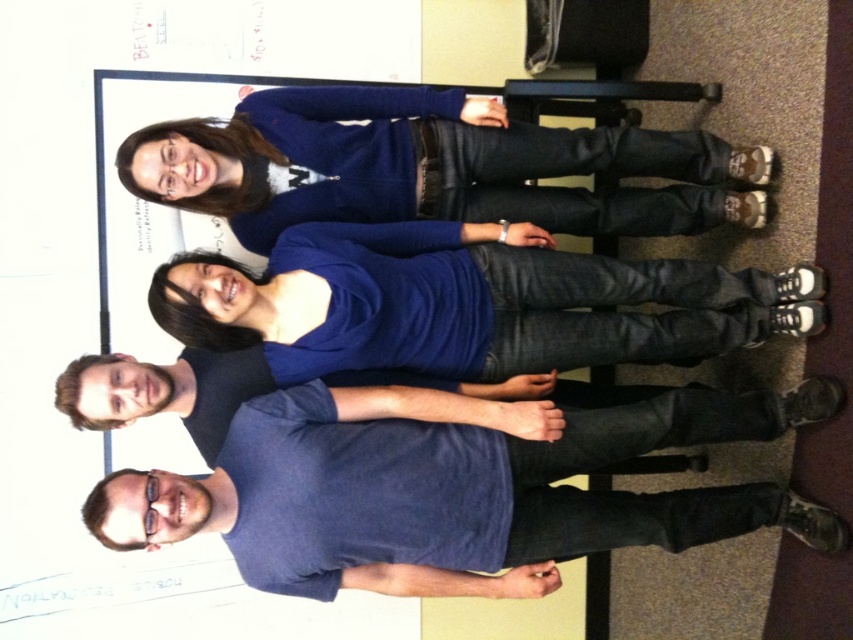
Question: Which point is closer to the camera?

Choices:
 (A) (196, 289)
 (B) (61, 397)
 (C) (265, 188)
 (D) (520, 541)

Answer: (B)

Question: In this image, where is blue sweater at upper center located relative to blue cotton t-shirt at center?

Choices:
 (A) above
 (B) below

Answer: (A)

Question: Which object is positioned farthest from the blue denim jeans at center?

Choices:
 (A) blue sweater at upper center
 (B) blue cotton t-shirt at lower center

Answer: (B)

Question: Based on their relative distances, which object is farther from the blue cotton t-shirt at lower center?

Choices:
 (A) blue cotton t-shirt at center
 (B) blue sweater at upper center

Answer: (B)

Question: Does blue denim jeans at center appear over blue sweater at upper center?

Choices:
 (A) yes
 (B) no

Answer: (B)

Question: Can you confirm if blue cotton t-shirt at lower center is positioned to the right of blue cotton t-shirt at center?

Choices:
 (A) yes
 (B) no

Answer: (A)